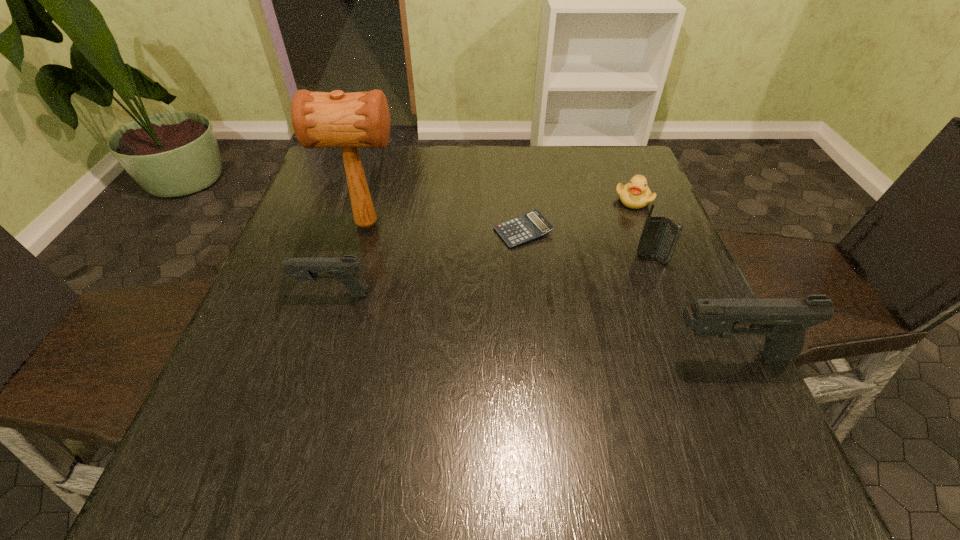
Please point a space for a new pistol to maintain equal intervals. Please provide its 2D coordinates. Your answer should be formatted as a tuple, i.e. [(x, y)], where the tuple contains the x and y coordinates of a point satisfying the conditions above.

[(519, 323)]